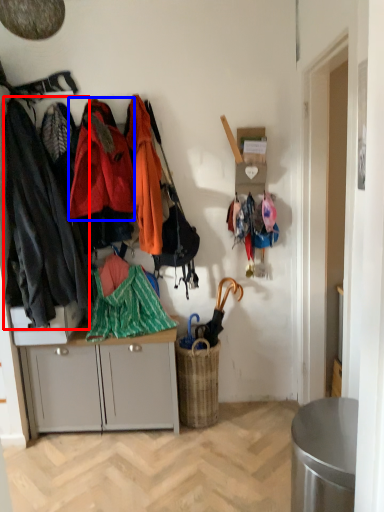
Question: Which point is closer to the camera, clothing (highlighted by a red box) or clothing (highlighted by a blue box)?

Choices:
 (A) clothing
 (B) clothing

Answer: (A)